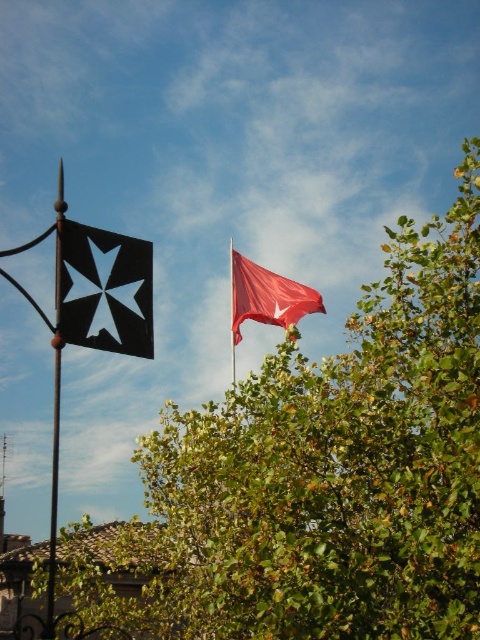
You are standing at the point marked by the coordinates point (106, 289), which is the black matte flag at left. Looking towards the tree in the lower right, what direction would the tree be relative to your position?

The tree is in the lower right of the image, so from the position of the black matte flag at left, the tree would be to the right and slightly downward direction.

You are standing at the center of the image. Which direction should you walk to reach the black matte flag at left?

The black matte flag at left is located at point 0.453 on the x axis and 0.221 on the y axis. Since you are at the center, you should walk towards the left and slightly upwards to reach the black matte flag at left.